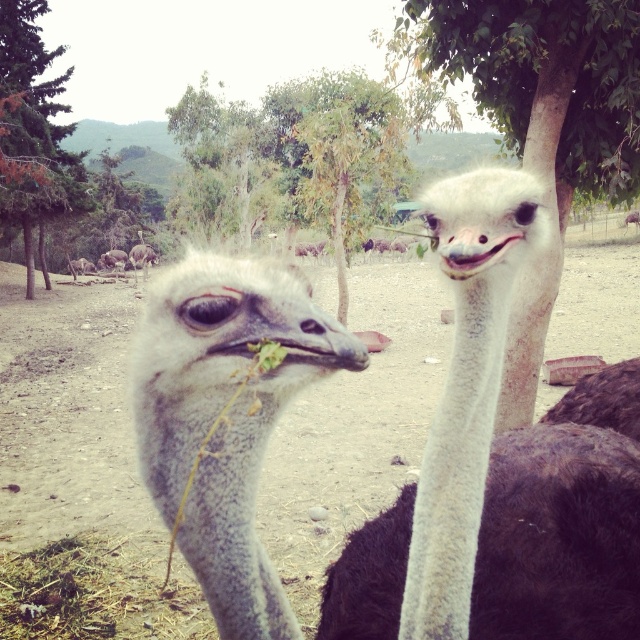
Is gray feathered ostrich at center behind green leafy tree at upper left?

No, gray feathered ostrich at center is closer to the viewer.

Based on the photo, which is above, gray feathered ostrich at center or green leafy tree at upper left?

green leafy tree at upper left

Is point (257, 552) less distant than point (32, 228)?

Yes, it is.

The height and width of the screenshot is (640, 640). Identify the location of gray feathered ostrich at center. (227, 416).

Is white feathered ostrich at center further to the viewer compared to green leafy tree at upper left?

No.

Is point (518, 541) more distant than point (51, 106)?

No, it is not.

I want to click on white feathered ostrich at center, so click(x=493, y=476).

Locate an element on the screen. This screenshot has width=640, height=640. white feathered ostrich at center is located at coordinates (493, 476).

Who is positioned more to the right, green leafy tree at upper center or white fuzzy neck at center?

green leafy tree at upper center is more to the right.

Is green leafy tree at upper center bigger than white fuzzy neck at center?

Correct, green leafy tree at upper center is larger in size than white fuzzy neck at center.

Does point (572, 179) lie in front of point (460, 509)?

No, it is not.

I want to click on green leafy tree at upper center, so click(x=544, y=124).